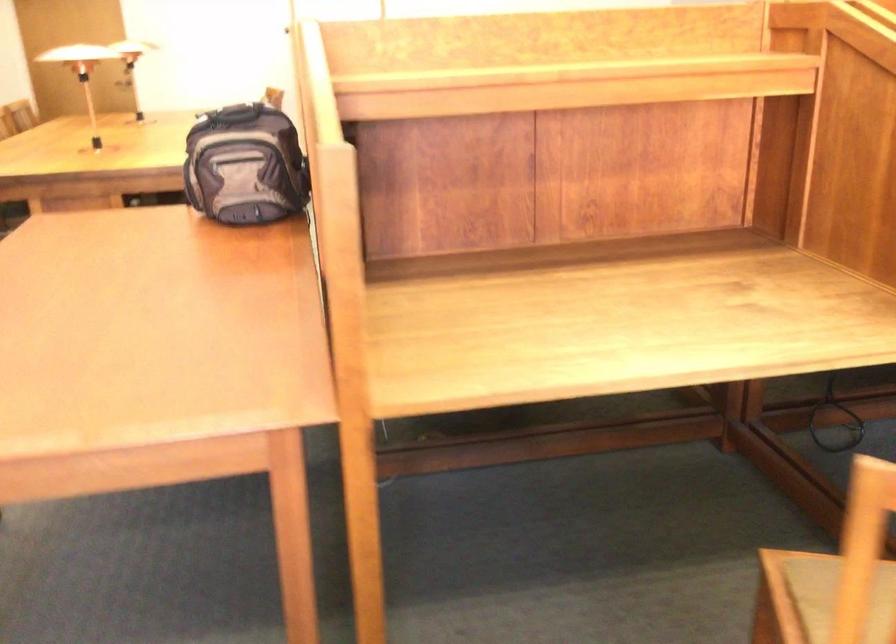
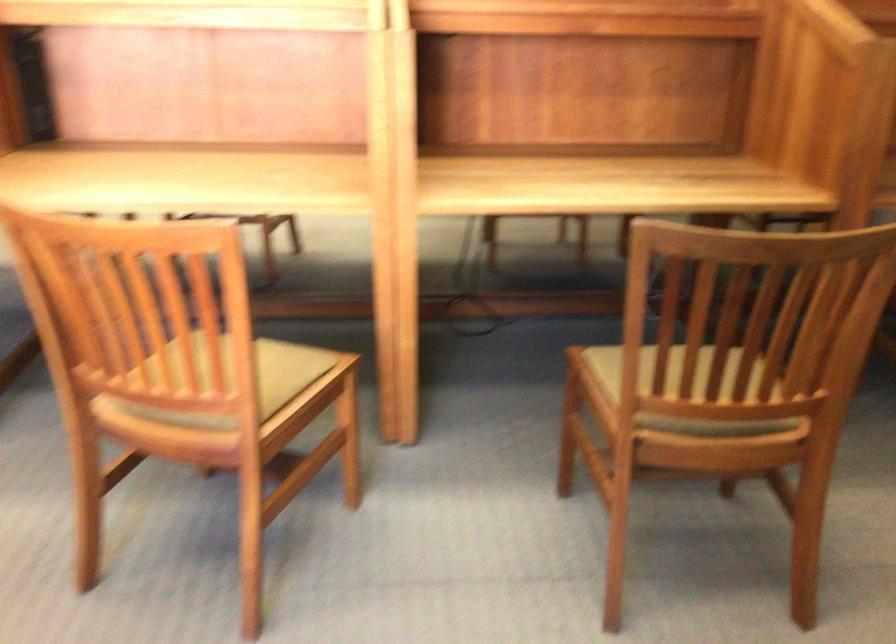
In a continuous first-person perspective shot, in which direction is the camera moving?

The movement direction of the cameraman is right, backward.